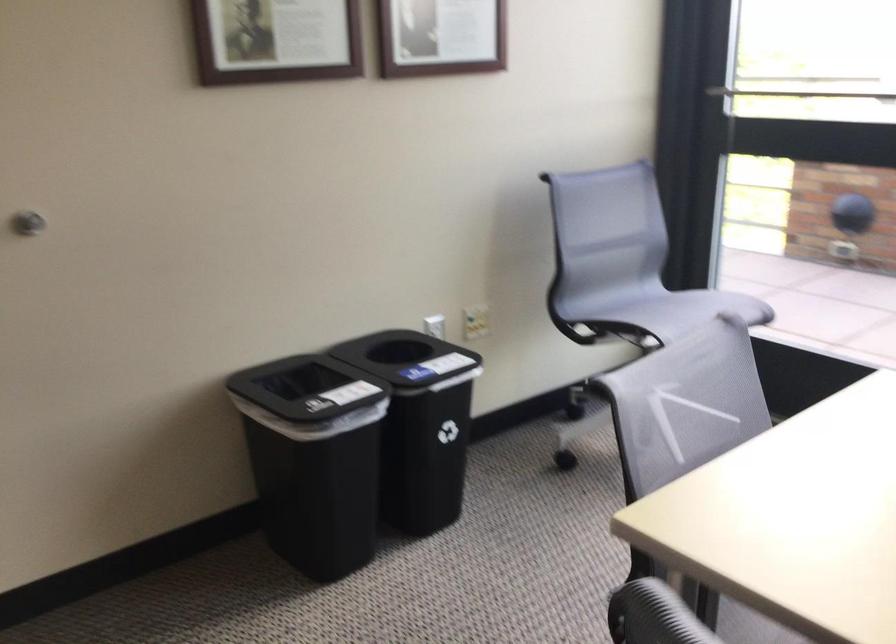
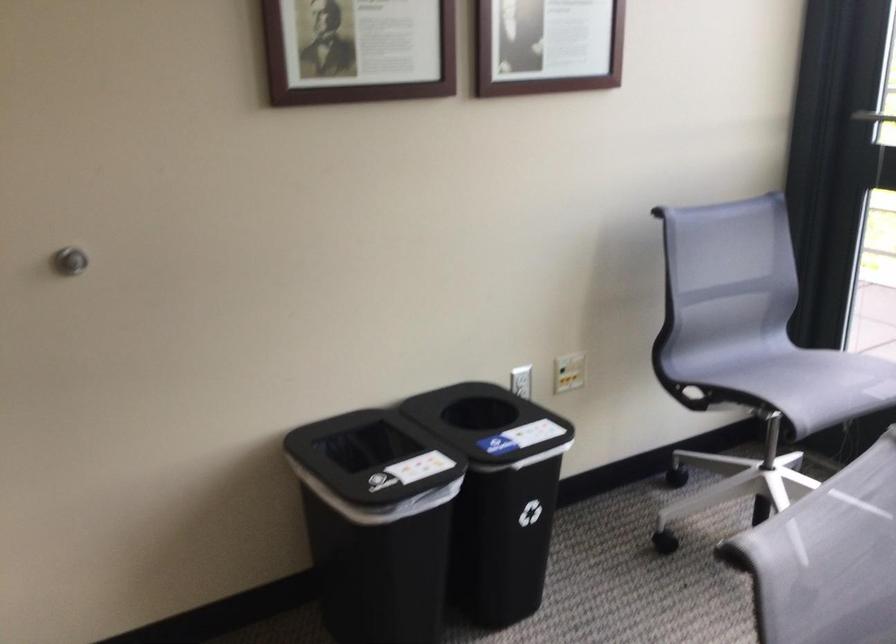
Question: The camera is either moving clockwise (left) or counter-clockwise (right) around the object. The first image is from the beginning of the video and the second image is from the end. Is the camera moving left or right when shooting the video?

Choices:
 (A) Left
 (B) Right

Answer: (B)